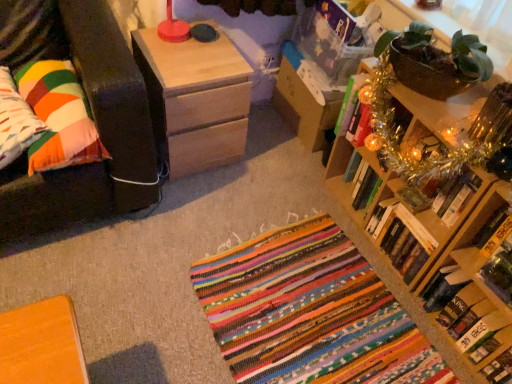
Locate an element on the screen. This screenshot has width=512, height=384. blank space to the left of hardcover book at center right, the third book when ordered from bottom to top is located at coordinates (356, 255).